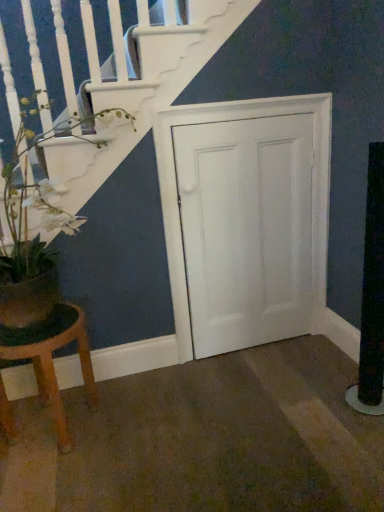
What is the approximate width of wooden stool at lower left?

It is 15.34 inches.

What do you see at coordinates (52, 361) in the screenshot?
I see `wooden stool at lower left` at bounding box center [52, 361].

Locate an element on the screen. The image size is (384, 512). wooden stool at lower left is located at coordinates (52, 361).

From the image's perspective, is wooden stool at lower left located above or below white wood door at center?

Clearly, from the image's perspective, wooden stool at lower left is below white wood door at center.

Between wooden stool at lower left and white wood door at center, which one is positioned in front?

Positioned in front is wooden stool at lower left.

Consider the image. Can you tell me how much wooden stool at lower left and white wood door at center differ in facing direction?

The facing directions of wooden stool at lower left and white wood door at center are 1.22 degrees apart.

Considering the sizes of objects wooden stool at lower left and white wood door at center in the image provided, who is shorter, wooden stool at lower left or white wood door at center?

wooden stool at lower left is shorter.

Between white wood door at center and green matte plant at left, which one appears on the right side from the viewer's perspective?

white wood door at center is more to the right.

Is white wood door at center in front of green matte plant at left?

No, white wood door at center is behind green matte plant at left.

Locate an element on the screen. Image resolution: width=384 pixels, height=512 pixels. door below the green matte plant at left (from a real-world perspective) is located at coordinates (247, 221).

Looking at their sizes, would you say white wood door at center is wider or thinner than green matte plant at left?

Considering their sizes, white wood door at center looks slimmer than green matte plant at left.

Considering the sizes of objects white wood door at center and wooden stool at lower left in the image provided, who is bigger, white wood door at center or wooden stool at lower left?

Bigger between the two is wooden stool at lower left.

Can you confirm if white wood door at center is shorter than wooden stool at lower left?

No.

From a real-world perspective, is white wood door at center located higher than wooden stool at lower left?

Yes.

Is point (27, 309) in front of point (8, 356)?

Yes, it is in front of point (8, 356).

From the image's perspective, would you say green matte plant at left is positioned over wooden stool at lower left?

Yes, from the image's perspective, green matte plant at left is over wooden stool at lower left.

Who is more distant, green matte plant at left or wooden stool at lower left?

wooden stool at lower left is further away from the camera.

Considering the positions of objects green matte plant at left and wooden stool at lower left in the image provided, who is more to the right, green matte plant at left or wooden stool at lower left?

Positioned to the right is green matte plant at left.

Is green matte plant at left wider or thinner than white wood door at center?

In the image, green matte plant at left appears to be wider than white wood door at center.

Can you see green matte plant at left touching white wood door at center?

No, green matte plant at left is not beside white wood door at center.

Is point (30, 317) closer or farther from the camera than point (265, 318)?

Point (30, 317) appears to be closer to the viewer than point (265, 318).

Who is shorter, wooden stool at lower left or green matte plant at left?

wooden stool at lower left.

Is wooden stool at lower left looking in the opposite direction of green matte plant at left?

No, wooden stool at lower left is not facing away from green matte plant at left.

Can you see wooden stool at lower left touching green matte plant at left?

They are not placed beside each other.

Would you say wooden stool at lower left is outside green matte plant at left?

Absolutely, wooden stool at lower left is external to green matte plant at left.

Where is `door above the wooden stool at lower left (from the image's perspective)`? door above the wooden stool at lower left (from the image's perspective) is located at coordinates (247, 221).

Locate an element on the screen. door located underneath the green matte plant at left (from a real-world perspective) is located at coordinates (247, 221).

Considering their positions, is green matte plant at left positioned closer to wooden stool at lower left than white wood door at center?

green matte plant at left.

In the scene shown: Which object lies nearer to the anchor point wooden stool at lower left, white wood door at center or green matte plant at left?

green matte plant at left.

Which object lies further to the anchor point green matte plant at left, wooden stool at lower left or white wood door at center?

white wood door at center is positioned further to the anchor green matte plant at left.

Which object lies further to the anchor point white wood door at center, green matte plant at left or wooden stool at lower left?

Among the two, wooden stool at lower left is located further to white wood door at center.

Considering their positions, is wooden stool at lower left positioned further to white wood door at center than green matte plant at left?

wooden stool at lower left lies further to white wood door at center than the other object.

Which object lies nearer to the anchor point green matte plant at left, white wood door at center or wooden stool at lower left?

wooden stool at lower left.

The image size is (384, 512). What are the coordinates of `houseplant between wooden stool at lower left and white wood door at center in the horizontal direction` in the screenshot? It's located at (27, 233).